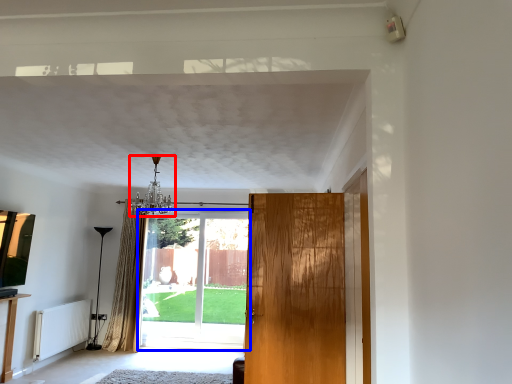
Question: Which object appears closest to the camera in this image, light fixture (highlighted by a red box) or door (highlighted by a blue box)?

Choices:
 (A) light fixture
 (B) door

Answer: (A)